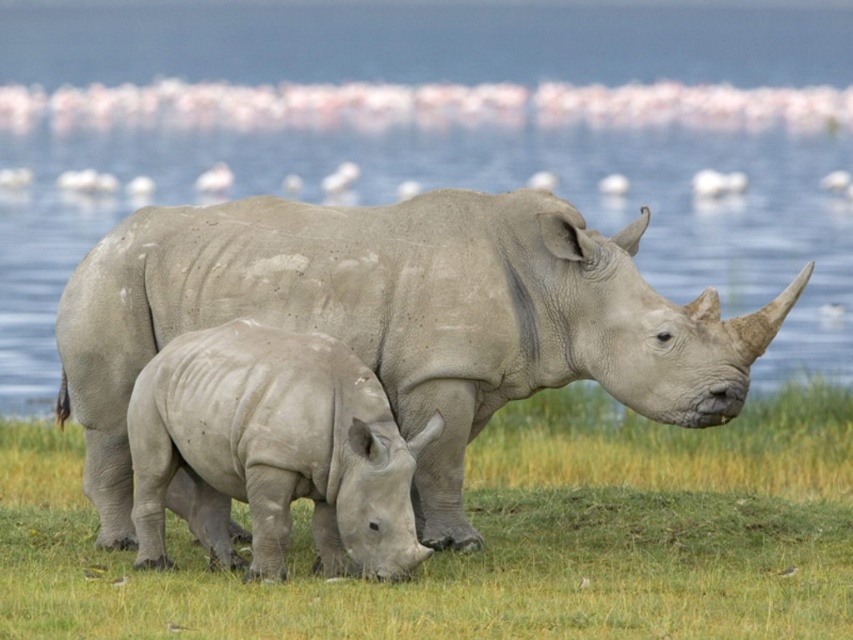
This screenshot has width=853, height=640. Find the location of `green grass at center`. green grass at center is located at coordinates (497, 538).

Does point (798, 627) lie behind point (503, 193)?

No, it is in front of (503, 193).

This screenshot has height=640, width=853. What do you see at coordinates (497, 538) in the screenshot?
I see `green grass at center` at bounding box center [497, 538].

Locate an element on the screen. The image size is (853, 640). green grass at center is located at coordinates (497, 538).

Can you confirm if matte gray rhinoceros at center is shorter than smooth gray rhino at center?

Incorrect, matte gray rhinoceros at center's height does not fall short of smooth gray rhino at center's.

Can you confirm if matte gray rhinoceros at center is positioned below smooth gray rhino at center?

No.

Does point (144, 276) lie behind point (351, 497)?

Yes, point (144, 276) is behind point (351, 497).

In order to click on matte gray rhinoceros at center in this screenshot , I will do `click(402, 321)`.

Who is taller, clear blue water at center or matte gray rhinoceros at center?

Standing taller between the two is matte gray rhinoceros at center.

Can you confirm if clear blue water at center is positioned to the left of matte gray rhinoceros at center?

No, clear blue water at center is not to the left of matte gray rhinoceros at center.

Who is more forward, (355, 77) or (235, 252)?

Point (235, 252) is in front.

Image resolution: width=853 pixels, height=640 pixels. I want to click on clear blue water at center, so click(440, 132).